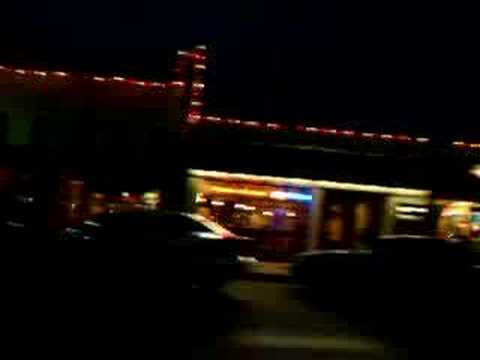
This screenshot has height=360, width=480. What are the coordinates of `single, solitary yellow light on the right hand side of the image` in the screenshot? It's located at (474, 172).